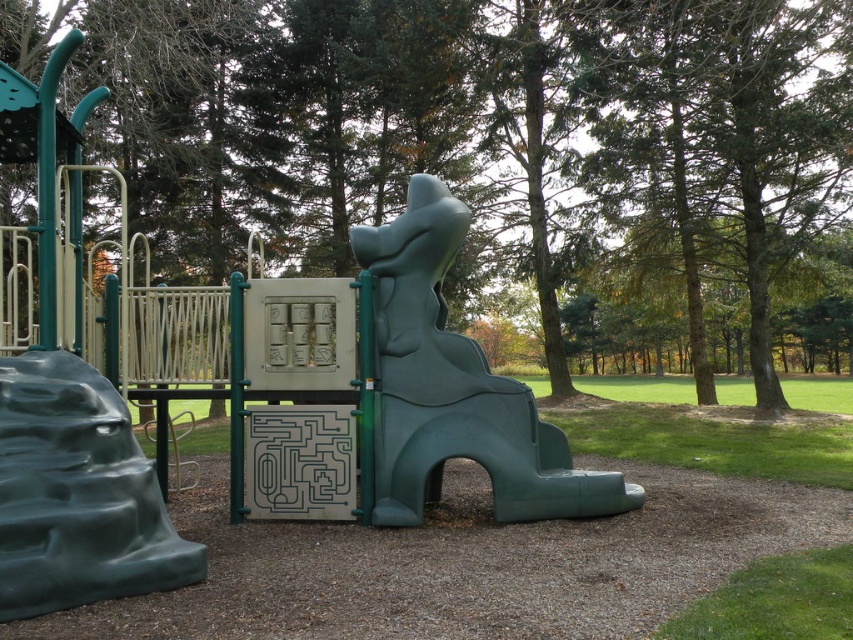
You are standing at the point marked by the coordinates point (456, 387) in the playground image. Based on the scene description, which object are you currently located on?

The point (456, 387) is on the teal matte slide at center, so you are currently located on the teal matte slide at center.

You are a parent trying to decide which slide is safer for your child. The teal matte slide at center has a textured surface, while the green rubber slide at lower left is made of a softer material. Based on their positions, which slide is higher up and might be more thrilling but also riskier?

The teal matte slide at center is above the green rubber slide at lower left, so it is higher up and could be more thrilling but also riskier due to its elevated position.